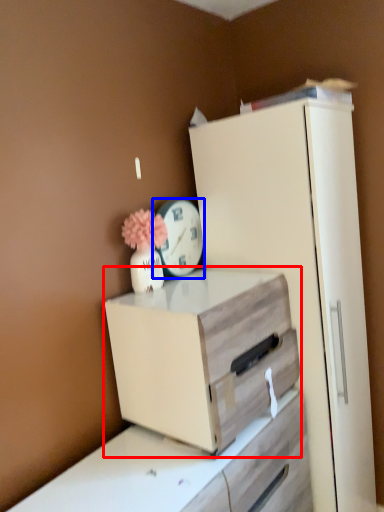
Question: Which object appears farthest to the camera in this image, chest of drawers (highlighted by a red box) or clock (highlighted by a blue box)?

Choices:
 (A) chest of drawers
 (B) clock

Answer: (B)